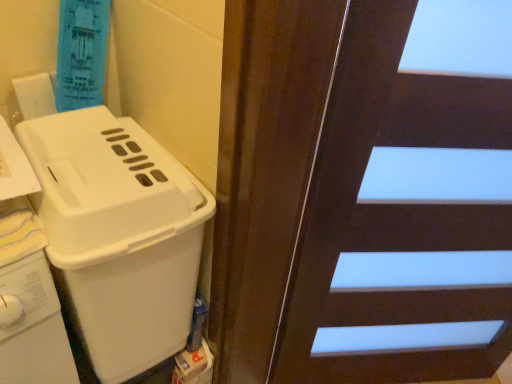
What do you see at coordinates (119, 234) in the screenshot?
I see `white plastic basket at left` at bounding box center [119, 234].

This screenshot has height=384, width=512. I want to click on white plastic basket at left, so click(x=119, y=234).

What is the approximate width of white plastic basket at left?

white plastic basket at left is 18.48 inches in width.

What do you see at coordinates (402, 221) in the screenshot?
I see `dark wood door at upper right` at bounding box center [402, 221].

In order to click on dark wood door at upper right in this screenshot , I will do `click(402, 221)`.

I want to click on white plastic basket at left, so click(119, 234).

Considering the relative positions of dark wood door at upper right and white plastic basket at left in the image provided, is dark wood door at upper right to the left of white plastic basket at left from the viewer's perspective?

Incorrect, dark wood door at upper right is not on the left side of white plastic basket at left.

Considering the positions of objects dark wood door at upper right and white plastic basket at left in the image provided, who is behind, dark wood door at upper right or white plastic basket at left?

white plastic basket at left is further from the camera.

Does point (382, 284) appear closer or farther from the camera than point (166, 197)?

Point (382, 284) appears to be farther away from the viewer than point (166, 197).

From the image's perspective, which one is positioned higher, dark wood door at upper right or white plastic basket at left?

white plastic basket at left.

From a real-world perspective, does dark wood door at upper right stand above white plastic basket at left?

Yes.

Which of these two, dark wood door at upper right or white plastic basket at left, is wider?

white plastic basket at left is wider.

In the scene shown: Which of these two, dark wood door at upper right or white plastic basket at left, stands shorter?

Standing shorter between the two is white plastic basket at left.

Can you confirm if dark wood door at upper right is smaller than white plastic basket at left?

No, dark wood door at upper right is not smaller than white plastic basket at left.

Can we say dark wood door at upper right lies outside white plastic basket at left?

dark wood door at upper right is positioned outside white plastic basket at left.

Is dark wood door at upper right not close to white plastic basket at left?

dark wood door at upper right is near white plastic basket at left, not far away.

Is dark wood door at upper right aimed at white plastic basket at left?

No, dark wood door at upper right is not aimed at white plastic basket at left.

Can you tell me how much dark wood door at upper right and white plastic basket at left differ in facing direction?

40 degrees separate the facing orientations of dark wood door at upper right and white plastic basket at left.

The width and height of the screenshot is (512, 384). There is a white plastic basket at left. Identify the location of door above it (from a real-world perspective). (402, 221).

Which object is positioned more to the right, white plastic basket at left or dark wood door at upper right?

Positioned to the right is dark wood door at upper right.

Is the position of white plastic basket at left less distant than that of dark wood door at upper right?

No, the depth of white plastic basket at left is greater than that of dark wood door at upper right.

Which is behind, point (70, 111) or point (328, 132)?

Positioned behind is point (70, 111).

From the image's perspective, is white plastic basket at left above or below dark wood door at upper right?

white plastic basket at left is above dark wood door at upper right.

From a real-world perspective, is white plastic basket at left under dark wood door at upper right?

Yes, from a real-world perspective, white plastic basket at left is below dark wood door at upper right.

Which of these two, white plastic basket at left or dark wood door at upper right, is thinner?

Thinner between the two is dark wood door at upper right.

Based on the photo, considering the sizes of objects white plastic basket at left and dark wood door at upper right in the image provided, who is shorter, white plastic basket at left or dark wood door at upper right?

white plastic basket at left.

Consider the image. Is white plastic basket at left bigger than dark wood door at upper right?

No, white plastic basket at left is not bigger than dark wood door at upper right.

Is white plastic basket at left positioned beyond the bounds of dark wood door at upper right?

Yes.

Would you say white plastic basket at left is a long distance from dark wood door at upper right?

No, white plastic basket at left is in close proximity to dark wood door at upper right.

Is white plastic basket at left positioned with its back to dark wood door at upper right?

white plastic basket at left does not have its back to dark wood door at upper right.

What's the angular difference between white plastic basket at left and dark wood door at upper right's facing directions?

40 degrees.

Measure the distance between white plastic basket at left and dark wood door at upper right.

white plastic basket at left is 46.92 centimeters from dark wood door at upper right.

The width and height of the screenshot is (512, 384). Find the location of `door on the right of the white plastic basket at left`. door on the right of the white plastic basket at left is located at coordinates (402, 221).

Image resolution: width=512 pixels, height=384 pixels. I want to click on door located in front of the white plastic basket at left, so click(402, 221).

Find the location of a particular element. Image resolution: width=512 pixels, height=384 pixels. door above the white plastic basket at left (from a real-world perspective) is located at coordinates (402, 221).